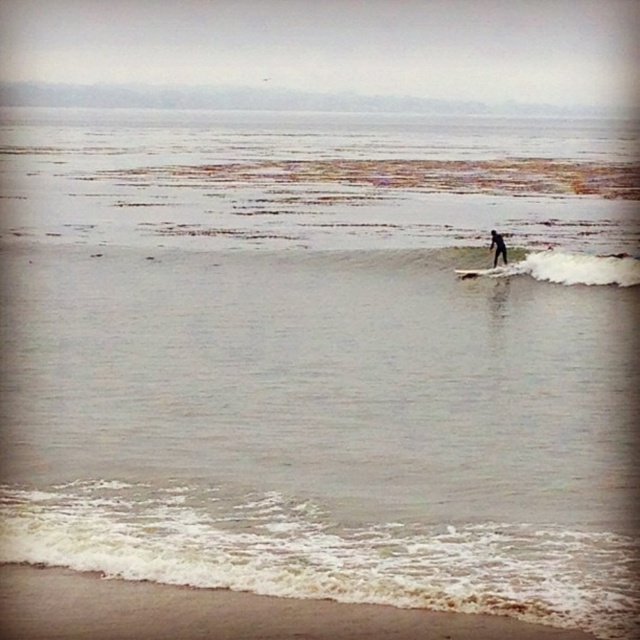
Question: Is white foam surfboard at center bigger than black matte surfboard at center?

Choices:
 (A) no
 (B) yes

Answer: (B)

Question: Which point is farther from the camera taking this photo?

Choices:
 (A) (456, 272)
 (B) (496, 230)

Answer: (B)

Question: Is white foam surfboard at center thinner than black matte surfboard at center?

Choices:
 (A) yes
 (B) no

Answer: (B)

Question: Among these points, which one is farthest from the camera?

Choices:
 (A) (493, 236)
 (B) (456, 273)

Answer: (A)

Question: Can you confirm if white foam surfboard at center is positioned above black matte surfboard at center?

Choices:
 (A) no
 (B) yes

Answer: (A)